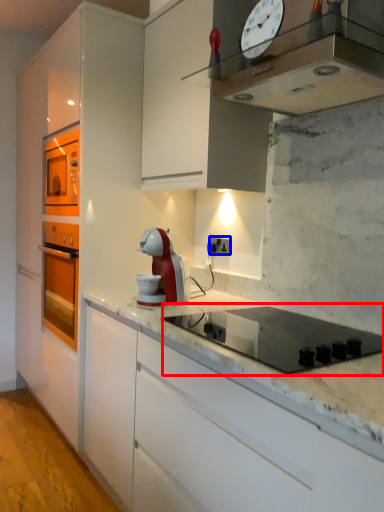
Question: Among these objects, which one is nearest to the camera, gas stove (highlighted by a red box) or electric outlet (highlighted by a blue box)?

Choices:
 (A) gas stove
 (B) electric outlet

Answer: (A)